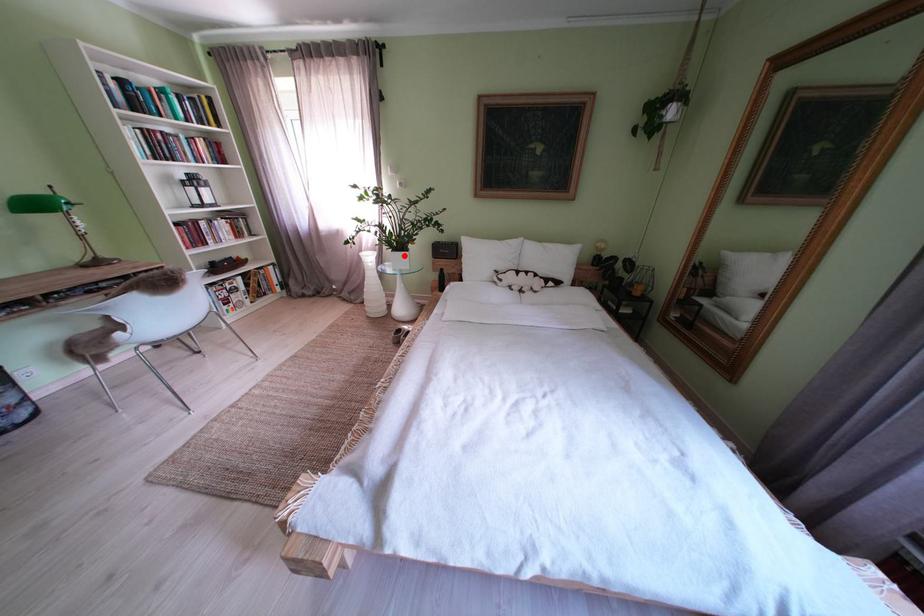
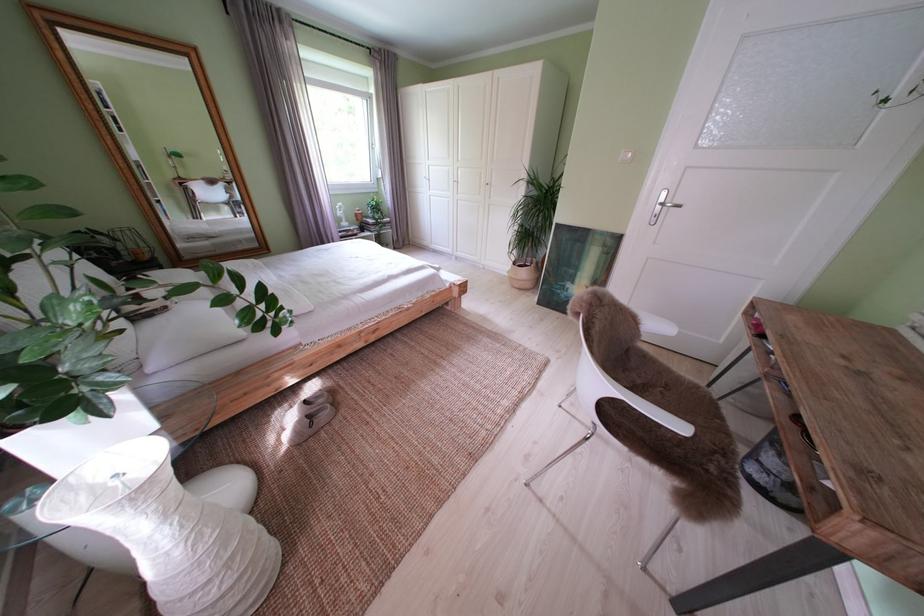
Question: A red point is marked in image1. In image2, is the corresponding 3D point closer to the camera or farther? Reply with the corresponding letter.

Choices:
 (A) The corresponding 3D point is closer.
 (B) The corresponding 3D point is farther.

Answer: (B)